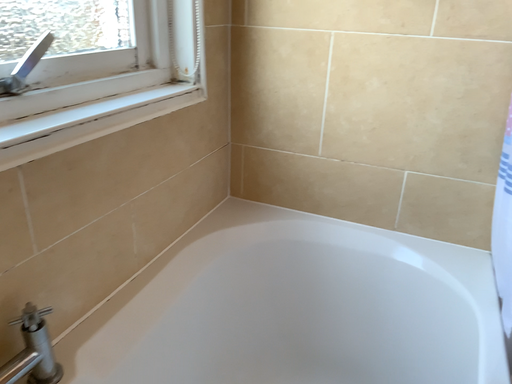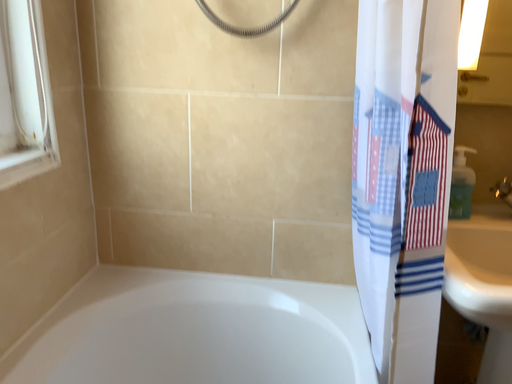
Question: Which way did the camera rotate in the video?

Choices:
 (A) rotated right
 (B) rotated left

Answer: (A)